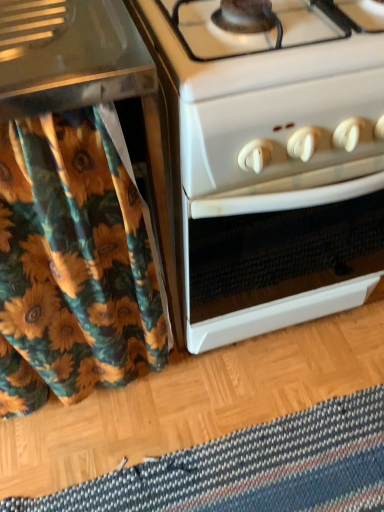
At what (x,y) coordinates should I click in order to perform the action: click on vacant region in front of floral fabric shower curtain at left. Please return your answer as a coordinate pair (x, y). The width and height of the screenshot is (384, 512). Looking at the image, I should click on (84, 458).